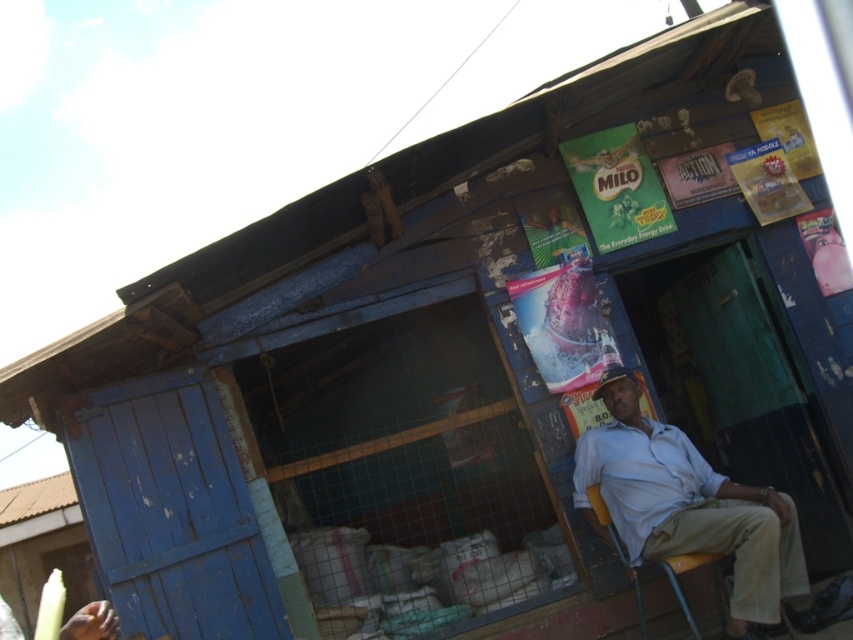
You are a customer entering the store through the doorway with the green door. As you walk in, you see the light blue shirt at center and the yellow plastic chair at lower right. Which object is taller?

The light blue shirt at center is much taller than the yellow plastic chair at lower right.

Based on the photo, you are a customer entering the store through the doorway. You see a light blue shirt at center and a yellow plastic chair at lower right. Which object is bigger in size?

The light blue shirt at center is larger in size than the yellow plastic chair at lower right.